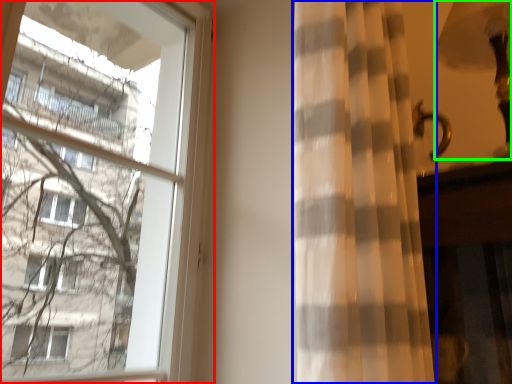
Question: Considering the real-world distances, which object is closest to window (highlighted by a red box)? curtain (highlighted by a blue box) or table lamp (highlighted by a green box).

Choices:
 (A) curtain
 (B) table lamp

Answer: (A)